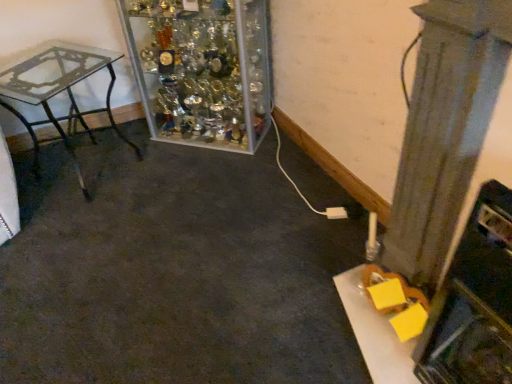
What do you see at coordinates (201, 69) in the screenshot?
I see `clear glass trophy case at upper center` at bounding box center [201, 69].

Image resolution: width=512 pixels, height=384 pixels. What are the coordinates of `clear glass trophy case at upper center` in the screenshot? It's located at (201, 69).

Does point (90, 70) appear closer or farther from the camera than point (413, 125)?

Point (90, 70) is positioned farther from the camera compared to point (413, 125).

In the scene shown: Is clear glass table at left in front of smooth gray pillar at right?

No, clear glass table at left is further to the viewer.

Considering the relative sizes of clear glass table at left and smooth gray pillar at right in the image provided, is clear glass table at left wider than smooth gray pillar at right?

Yes, clear glass table at left is wider than smooth gray pillar at right.

At what (x,y) coordinates should I click in order to perform the action: click on table on the left of smooth gray pillar at right. Please return your answer as a coordinate pair (x, y). Looking at the image, I should click on [59, 92].

Which is nearer, (x=142, y=41) or (x=486, y=77)?

Positioned in front is point (x=486, y=77).

Considering the sizes of clear glass trophy case at upper center and smooth gray pillar at right in the image, is clear glass trophy case at upper center bigger or smaller than smooth gray pillar at right?

clear glass trophy case at upper center is bigger than smooth gray pillar at right.

Does clear glass trophy case at upper center have a greater width compared to smooth gray pillar at right?

Correct, the width of clear glass trophy case at upper center exceeds that of smooth gray pillar at right.

This screenshot has height=384, width=512. Identify the location of furniture above the smooth gray pillar at right (from the image's perspective). (201, 69).

Considering the positions of objects clear glass trophy case at upper center and clear glass table at left in the image provided, who is behind, clear glass trophy case at upper center or clear glass table at left?

clear glass trophy case at upper center.

Can you confirm if clear glass trophy case at upper center is bigger than clear glass table at left?

Indeed, clear glass trophy case at upper center has a larger size compared to clear glass table at left.

Is clear glass trophy case at upper center to the right of clear glass table at left from the viewer's perspective?

Correct, you'll find clear glass trophy case at upper center to the right of clear glass table at left.

Are clear glass trophy case at upper center and clear glass table at left far apart?

clear glass trophy case at upper center is near clear glass table at left, not far away.

Considering the sizes of smooth gray pillar at right and clear glass trophy case at upper center in the image, is smooth gray pillar at right wider or thinner than clear glass trophy case at upper center?

Considering their sizes, smooth gray pillar at right looks slimmer than clear glass trophy case at upper center.

Is smooth gray pillar at right taller or shorter than clear glass trophy case at upper center?

In the image, smooth gray pillar at right appears to be taller than clear glass trophy case at upper center.

Does smooth gray pillar at right have a smaller size compared to clear glass trophy case at upper center?

Yes, smooth gray pillar at right is smaller than clear glass trophy case at upper center.

Choose the correct answer: Is smooth gray pillar at right inside clear glass trophy case at upper center or outside it?

smooth gray pillar at right cannot be found inside clear glass trophy case at upper center.

From a real-world perspective, which is physically below, clear glass table at left or clear glass trophy case at upper center?

From a 3D spatial view, clear glass table at left is below.

Can you tell me how much clear glass table at left and clear glass trophy case at upper center differ in facing direction?

They differ by 69.5 degrees in their facing directions.

Would you consider clear glass table at left to be distant from clear glass trophy case at upper center?

No, clear glass table at left is not far away from clear glass trophy case at upper center.

Measure the distance between clear glass table at left and clear glass trophy case at upper center.

17.62 inches.

Do you think smooth gray pillar at right is within clear glass table at left, or outside of it?

smooth gray pillar at right is not enclosed by clear glass table at left.

Relative to clear glass table at left, is smooth gray pillar at right in front or behind?

Visually, smooth gray pillar at right is located in front of clear glass table at left.

From a real-world perspective, which is physically above, smooth gray pillar at right or clear glass table at left?

From a 3D spatial view, smooth gray pillar at right is above.

Are smooth gray pillar at right and clear glass table at left far apart?

Yes.

Locate an element on the screen. Image resolution: width=512 pixels, height=384 pixels. table below the smooth gray pillar at right (from a real-world perspective) is located at coordinates (59, 92).

Locate an element on the screen. The height and width of the screenshot is (384, 512). furniture on the left side of smooth gray pillar at right is located at coordinates (201, 69).

When comparing their distances from clear glass table at left, does smooth gray pillar at right or clear glass trophy case at upper center seem closer?

The object closer to clear glass table at left is clear glass trophy case at upper center.

Which object lies further to the anchor point clear glass table at left, clear glass trophy case at upper center or smooth gray pillar at right?

smooth gray pillar at right lies further to clear glass table at left than the other object.

Looking at the image, which one is located closer to clear glass trophy case at upper center, smooth gray pillar at right or clear glass table at left?

Based on the image, clear glass table at left appears to be nearer to clear glass trophy case at upper center.

From the picture: Based on their spatial positions, is clear glass table at left or smooth gray pillar at right closer to clear glass trophy case at upper center?

Based on the image, clear glass table at left appears to be nearer to clear glass trophy case at upper center.

Looking at the image, which one is located closer to smooth gray pillar at right, clear glass trophy case at upper center or clear glass table at left?

clear glass trophy case at upper center is positioned closer to the anchor smooth gray pillar at right.

Looking at the image, which one is located closer to smooth gray pillar at right, clear glass table at left or clear glass trophy case at upper center?

clear glass trophy case at upper center.

I want to click on furniture between clear glass table at left and smooth gray pillar at right, so click(x=201, y=69).